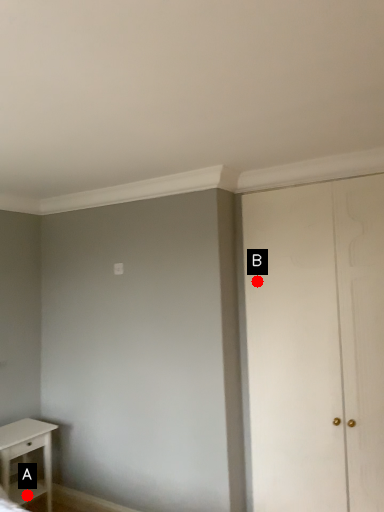
Question: Two points are circled on the image, labeled by A and B beside each circle. Which point is further to the camera?

Choices:
 (A) A is further
 (B) B is further

Answer: (A)